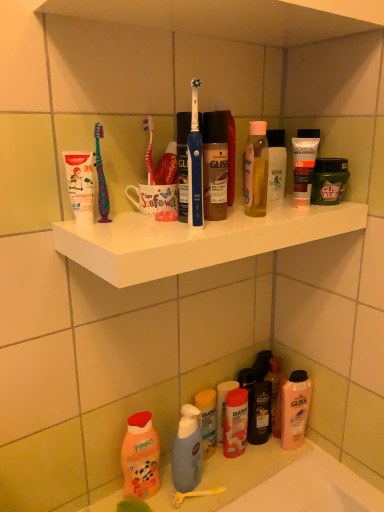
Question: Can you confirm if pink matte shampoo at lower right, which ranks as the 2th cleaning product in front-to-back order, is shorter than white matte shelf at upper center?

Choices:
 (A) no
 (B) yes

Answer: (A)

Question: From a real-world perspective, is pink matte shampoo at lower right, the first cleaning product viewed from the right, physically below white matte shelf at upper center?

Choices:
 (A) yes
 (B) no

Answer: (A)

Question: Is pink matte shampoo at lower right, which ranks as the 2th cleaning product in front-to-back order, not within white matte shelf at upper center?

Choices:
 (A) no
 (B) yes

Answer: (B)

Question: Is pink matte shampoo at lower right, the first cleaning product viewed from the right, taller than white matte shelf at upper center?

Choices:
 (A) yes
 (B) no

Answer: (A)

Question: Is pink matte shampoo at lower right, acting as the first cleaning product starting from the back, beside white matte shelf at upper center?

Choices:
 (A) yes
 (B) no

Answer: (B)

Question: Is green matte hair mask at upper right, acting as the first toiletry starting from the right, taller or shorter than white matte toothpaste tube at upper left, positioned as the third toiletry in top-to-bottom order?

Choices:
 (A) tall
 (B) short

Answer: (B)

Question: Does point (334, 159) appear closer or farther from the camera than point (87, 217)?

Choices:
 (A) closer
 (B) farther

Answer: (B)

Question: Would you say green matte hair mask at upper right, which appears as the 2th toiletry when viewed from the top, is to the left or to the right of white matte toothpaste tube at upper left, which is counted as the fourth toiletry, starting from the bottom, in the picture?

Choices:
 (A) left
 (B) right

Answer: (B)

Question: From the image's perspective, is green matte hair mask at upper right, marked as the 6th toiletry in a left-to-right arrangement, positioned above or below white matte toothpaste tube at upper left, the 6th toiletry from the right?

Choices:
 (A) above
 (B) below

Answer: (A)

Question: In terms of height, does green matte hair mask at upper right, marked as the 6th toiletry in a left-to-right arrangement, look taller or shorter compared to matte black tube at upper right, the sixth toiletry when ordered from bottom to top?

Choices:
 (A) tall
 (B) short

Answer: (B)

Question: From a real-world perspective, is green matte hair mask at upper right, acting as the first toiletry starting from the right, positioned above or below matte black tube at upper right, the fifth toiletry in the left-to-right sequence?

Choices:
 (A) above
 (B) below

Answer: (B)

Question: Choose the correct answer: Is green matte hair mask at upper right, which appears as the 2th toiletry when viewed from the top, inside matte black tube at upper right, acting as the 1th toiletry starting from the top, or outside it?

Choices:
 (A) inside
 (B) outside

Answer: (B)

Question: Would you say green matte hair mask at upper right, which is the 5th toiletry from bottom to top, is to the left or to the right of matte black tube at upper right, the sixth toiletry when ordered from bottom to top, in the picture?

Choices:
 (A) right
 (B) left

Answer: (A)

Question: Considering the positions of matte black tube at upper right, the sixth toiletry when ordered from bottom to top, and translucent plastic bottle at lower center, the third toiletry from the left, in the image, is matte black tube at upper right, the sixth toiletry when ordered from bottom to top, taller or shorter than translucent plastic bottle at lower center, the third toiletry from the left,?

Choices:
 (A) short
 (B) tall

Answer: (A)

Question: Considering the relative positions of matte black tube at upper right, acting as the 1th toiletry starting from the top, and translucent plastic bottle at lower center, the 3th toiletry when ordered from bottom to top, in the image provided, is matte black tube at upper right, acting as the 1th toiletry starting from the top, to the left or to the right of translucent plastic bottle at lower center, the 3th toiletry when ordered from bottom to top,?

Choices:
 (A) right
 (B) left

Answer: (A)